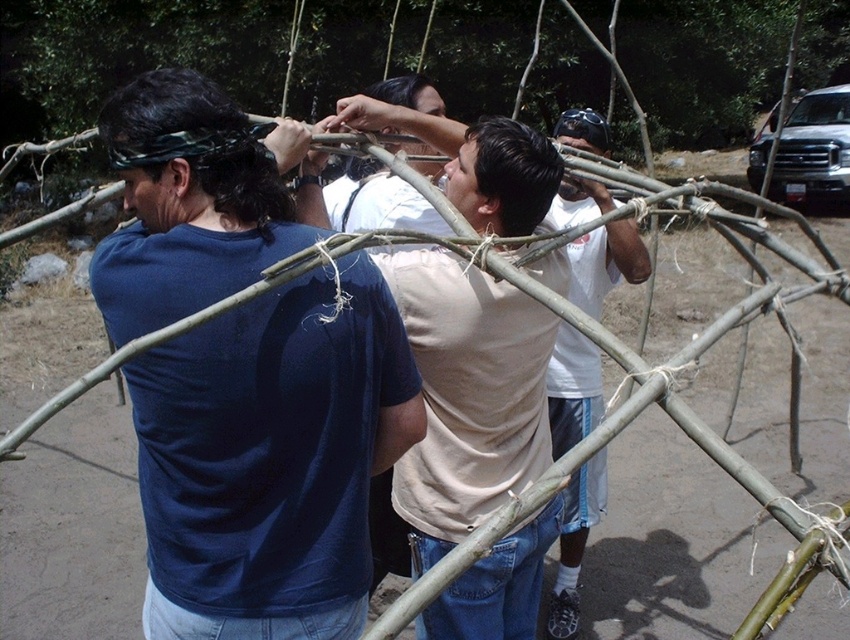
You are standing in front of the structure being built by the group. There are two points marked on the structure at coordinates point (x=388, y=436) and point (x=601, y=412). Which point is closer to you?

Point (x=388, y=436) is closer to the viewer than point (x=601, y=412).